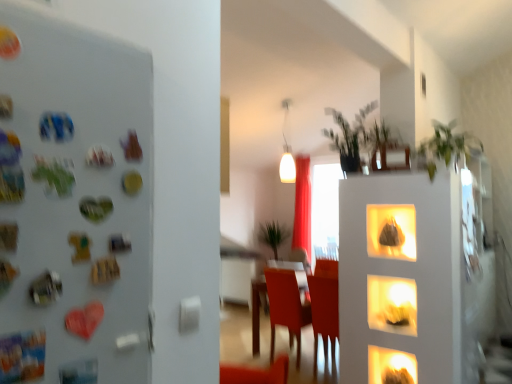
Question: Is green leafy plant at upper center, which is the second plant from back to front, positioned in front of matte plastic chair at center?

Choices:
 (A) yes
 (B) no

Answer: (A)

Question: Considering the relative sizes of green leafy plant at upper center, acting as the 4th plant starting from the bottom, and matte plastic chair at center in the image provided, is green leafy plant at upper center, acting as the 4th plant starting from the bottom, bigger than matte plastic chair at center?

Choices:
 (A) yes
 (B) no

Answer: (B)

Question: Does green leafy plant at upper center, which is counted as the first plant, starting from the top, have a greater height compared to matte plastic chair at center?

Choices:
 (A) yes
 (B) no

Answer: (B)

Question: Is green leafy plant at upper center, the 3th plant when ordered from front to back, at the right side of matte plastic chair at center?

Choices:
 (A) yes
 (B) no

Answer: (A)

Question: Could you tell me if green leafy plant at upper center, acting as the 4th plant starting from the bottom, is facing matte plastic chair at center?

Choices:
 (A) no
 (B) yes

Answer: (A)

Question: Is white glossy lamp at upper center taller or shorter than green leafy plant at upper right, placed as the fourth plant when sorted from back to front?

Choices:
 (A) short
 (B) tall

Answer: (B)

Question: Is white glossy lamp at upper center wider or thinner than green leafy plant at upper right, placed as the fourth plant when sorted from back to front?

Choices:
 (A) wide
 (B) thin

Answer: (B)

Question: Choose the correct answer: Is white glossy lamp at upper center inside green leafy plant at upper right, the first plant positioned from the front, or outside it?

Choices:
 (A) inside
 (B) outside

Answer: (B)

Question: Considering the relative positions of white glossy lamp at upper center and green leafy plant at upper right, acting as the third plant starting from the bottom, in the image provided, is white glossy lamp at upper center to the left or to the right of green leafy plant at upper right, acting as the third plant starting from the bottom,?

Choices:
 (A) left
 (B) right

Answer: (A)

Question: Is point (373, 144) positioned closer to the camera than point (272, 352)?

Choices:
 (A) closer
 (B) farther

Answer: (A)

Question: Is green leafy plant at upper center, which is counted as the 3th plant, starting from the top, bigger or smaller than matte plastic chair at center?

Choices:
 (A) small
 (B) big

Answer: (A)

Question: Relative to matte plastic chair at center, is green leafy plant at upper center, the 2th plant ordered from the bottom, in front or behind?

Choices:
 (A) front
 (B) behind

Answer: (A)

Question: Looking at their shapes, would you say green leafy plant at upper center, which is counted as the 3th plant, starting from the top, is wider or thinner than matte plastic chair at center?

Choices:
 (A) thin
 (B) wide

Answer: (A)

Question: Would you say white glossy lamp at upper center is to the left or to the right of green leafy plant at upper center, which is counted as the 3th plant, starting from the top, in the picture?

Choices:
 (A) right
 (B) left

Answer: (B)

Question: Is white glossy lamp at upper center wider or thinner than green leafy plant at upper center, which is counted as the 3th plant, starting from the back?

Choices:
 (A) thin
 (B) wide

Answer: (A)